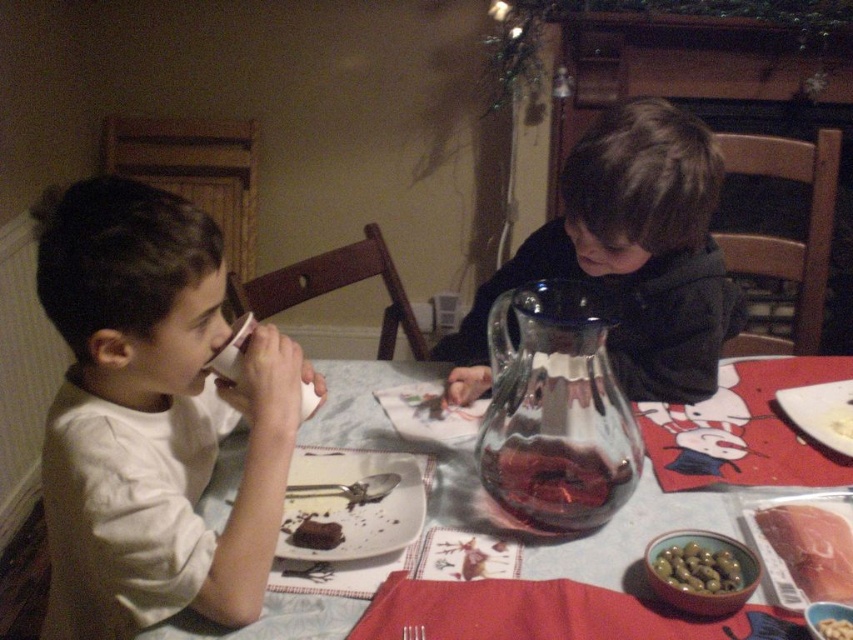
You are standing in the room and want to place a new decoration exactly at the center of the room. The dark blue fabric jacket at upper right is located at coordinates point 0.400, 0.737. Can you determine if the jacket is closer to the left or right side of the room?

The dark blue fabric jacket at upper right is located at coordinates point [628,256]. Since the x coordinate is 0.400, which is less than 0.5, it is closer to the left side of the room.

You are a parent trying to pour juice from the transparent glass pitcher at center into a cup. Where exactly should you position the cup to catch the juice effectively?

The transparent glass pitcher at center is located at point (556,410), so you should position the cup directly below this coordinate to catch the juice effectively.